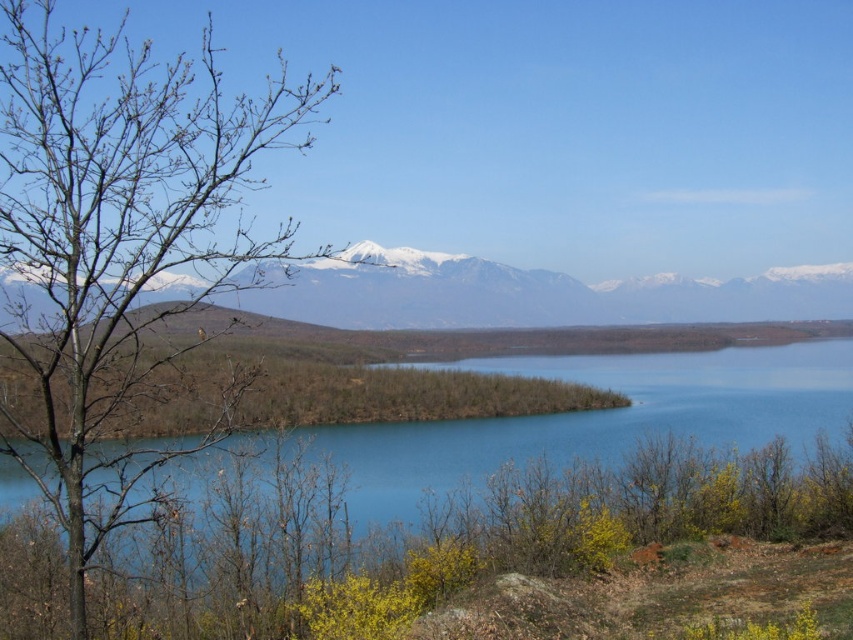
Is bare branches at left bigger than blue water at center?

Correct, bare branches at left is larger in size than blue water at center.

Does point (109, 358) lie in front of point (669, 388)?

Yes, point (109, 358) is in front of point (669, 388).

Locate an element on the screen. bare branches at left is located at coordinates (117, 243).

Is blue water at center in front of snowy white mountain range at upper center?

No, blue water at center is further to the viewer.

Can you confirm if blue water at center is bigger than snowy white mountain range at upper center?

Incorrect, blue water at center is not larger than snowy white mountain range at upper center.

Identify the location of blue water at center. The width and height of the screenshot is (853, 640). (599, 417).

Is bare branches at left to the right of snowy white mountain range at upper center from the viewer's perspective?

Incorrect, bare branches at left is not on the right side of snowy white mountain range at upper center.

Which is more to the left, bare branches at left or snowy white mountain range at upper center?

bare branches at left is more to the left.

Locate an element on the screen. bare branches at left is located at coordinates (117, 243).